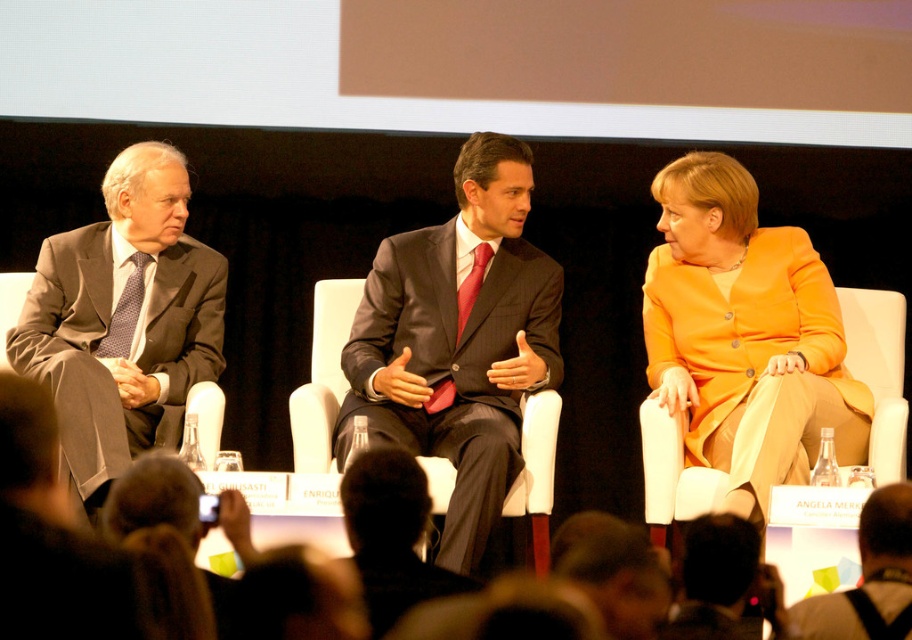
You are an event photographer at the panel discussion. You need to capture a photo where the orange fabric dress at upper right and the black fabric head at lower center are both visible. Based on their positions, which object will appear larger in the photo?

The orange fabric dress at upper right will appear larger in the photo because it is taller than the black fabric head at lower center.

You are a photographer standing in front of the stage. You want to take a closeup shot of the dark hair at lower center. Based on the coordinates provided, where should you aim your camera?

The dark hair at lower center is located at coordinates point (614, 572), so aim your camera at that specific point to capture it.

You are an event organizer and need to place a name tag on the stage for the panel discussion. The name tag must be placed to the left of the brushed metal water at bottle left. Where should you place it?

Since the brushed metal water at bottle left is located at point 0.903 on the x and 0.954 on the y coordinate, placing the name tag to the left of it would mean positioning it at a lower x coordinate than 0.903, while keeping the y coordinate around 0.954 to maintain alignment.